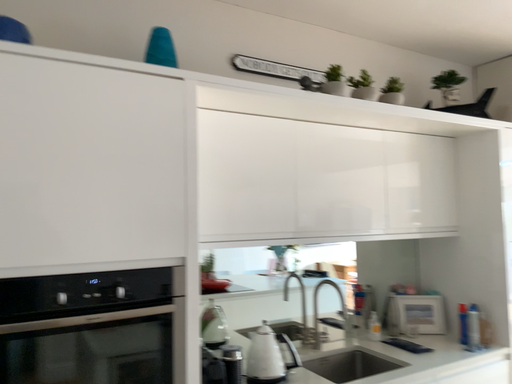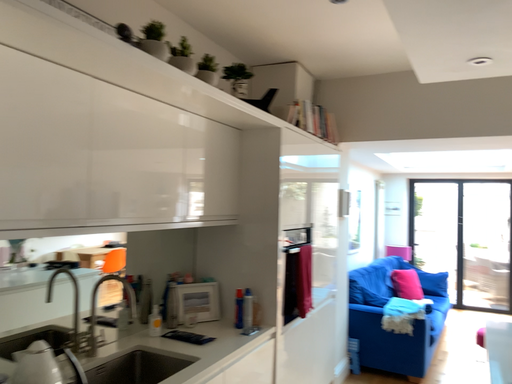
Question: How did the camera likely rotate when shooting the video?

Choices:
 (A) rotated right
 (B) rotated left

Answer: (A)